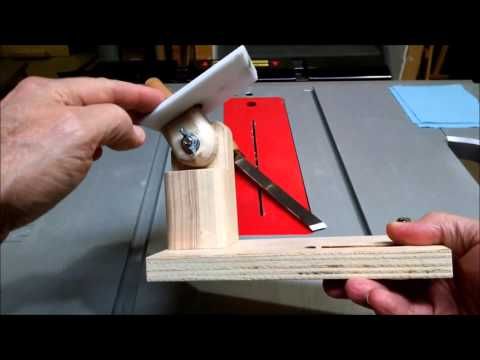
Where is `grey table`? This screenshot has height=360, width=480. grey table is located at coordinates (367, 133).